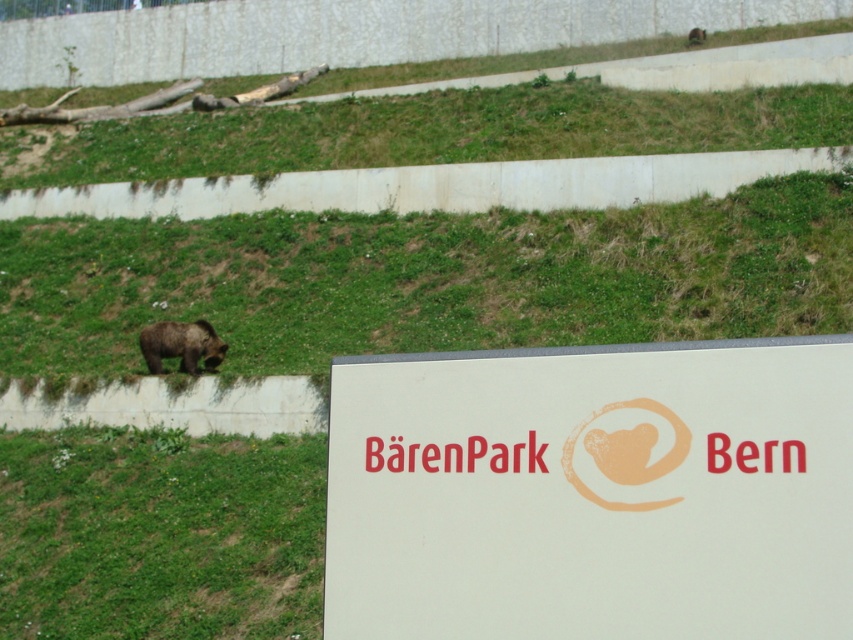
Question: Is white matte sign at center below brown furry bear at lower left?

Choices:
 (A) yes
 (B) no

Answer: (A)

Question: Does white matte sign at center appear on the right side of brown furry bear at lower left?

Choices:
 (A) no
 (B) yes

Answer: (B)

Question: Among these points, which one is farthest from the camera?

Choices:
 (A) (199, 346)
 (B) (575, 545)

Answer: (A)

Question: Among these objects, which one is nearest to the camera?

Choices:
 (A) white matte sign at center
 (B) brown furry bear at lower left

Answer: (A)

Question: Does white matte sign at center lie in front of brown furry bear at lower left?

Choices:
 (A) yes
 (B) no

Answer: (A)